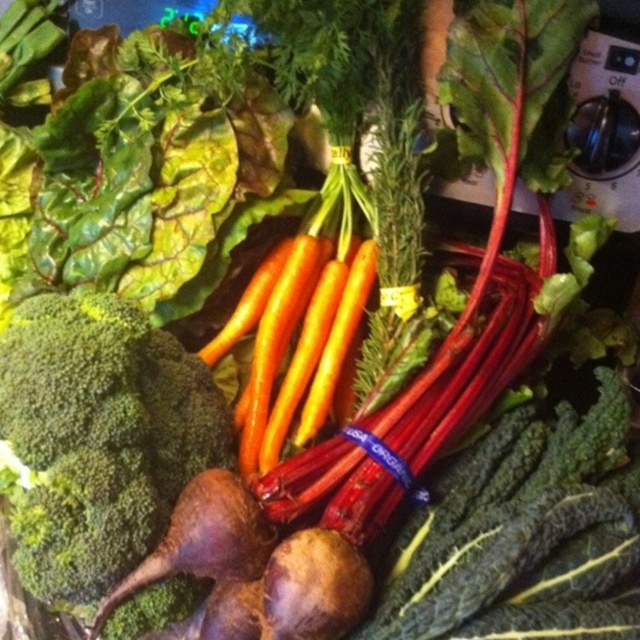
Is green matte broccoli at lower left in front of orange smooth carrot at center?

Yes.

Between point (36, 556) and point (284, 317), which one is positioned behind?

The point (284, 317) is behind.

Locate an element on the screen. This screenshot has height=640, width=640. green matte broccoli at lower left is located at coordinates (99, 436).